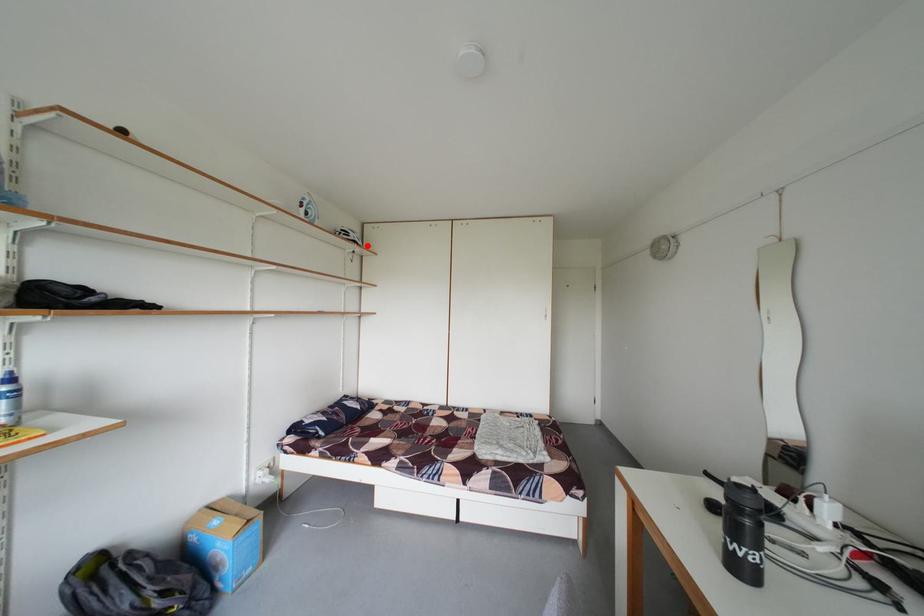
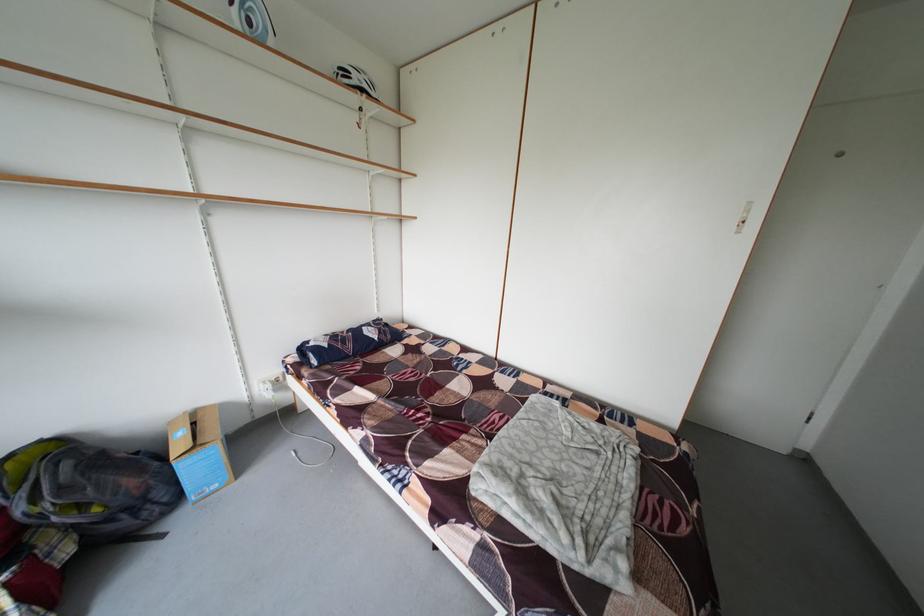
Find the pixel in the second image that matches the highlighted location in the first image.

(375, 92)